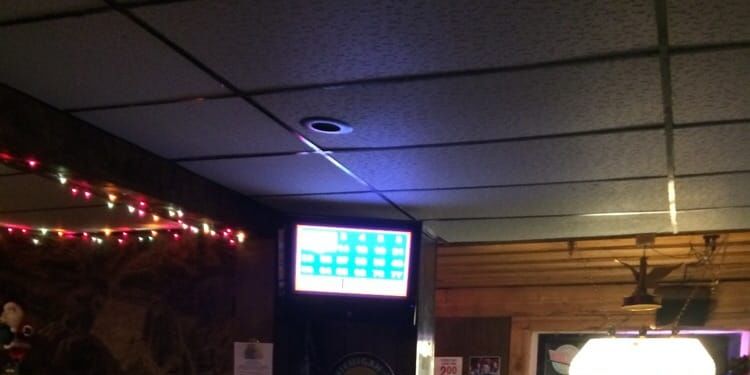
This screenshot has width=750, height=375. What are the coordinates of `strip of christamas lights` in the screenshot? It's located at (146, 212).